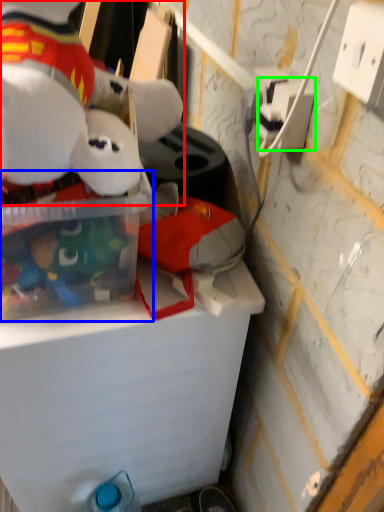
Question: Considering the real-world distances, which object is closest to toy (highlighted by a red box)? storage box (highlighted by a blue box) or power outlet (highlighted by a green box).

Choices:
 (A) storage box
 (B) power outlet

Answer: (A)